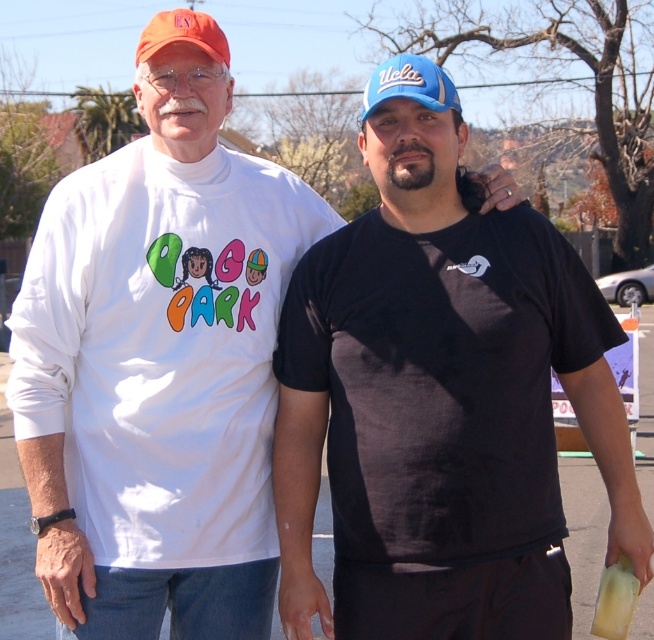
Question: Estimate the real-world distances between objects in this image. Which object is farther from the white matte t-shirt at left?

Choices:
 (A) black matte t-shirt at center
 (B) orange matte baseball cap at upper left
 (C) blue fabric baseball cap at upper center

Answer: (B)

Question: Is black matte t-shirt at center wider than orange matte baseball cap at upper left?

Choices:
 (A) no
 (B) yes

Answer: (A)

Question: Considering the real-world distances, which object is farthest from the blue fabric baseball cap at upper center?

Choices:
 (A) white matte t-shirt at left
 (B) black matte t-shirt at center

Answer: (A)

Question: Does black matte t-shirt at center lie behind white matte t-shirt at left?

Choices:
 (A) yes
 (B) no

Answer: (B)

Question: Which object is farther from the camera taking this photo?

Choices:
 (A) orange matte baseball cap at upper left
 (B) white matte t-shirt at left

Answer: (A)

Question: Can you confirm if black matte t-shirt at center is positioned to the right of orange matte baseball cap at upper left?

Choices:
 (A) yes
 (B) no

Answer: (A)